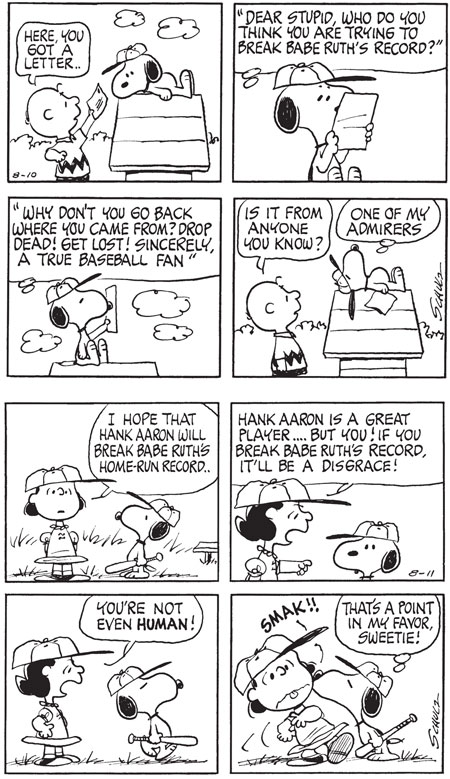
At what (x,y) coordinates should I click in order to perform the action: click on panels. Please return your answer as a coordinate pair (x, y). Image resolution: width=450 pixels, height=779 pixels. Looking at the image, I should click on (380, 92), (196, 83), (148, 314), (345, 298), (185, 449), (341, 485), (283, 614), (168, 640).